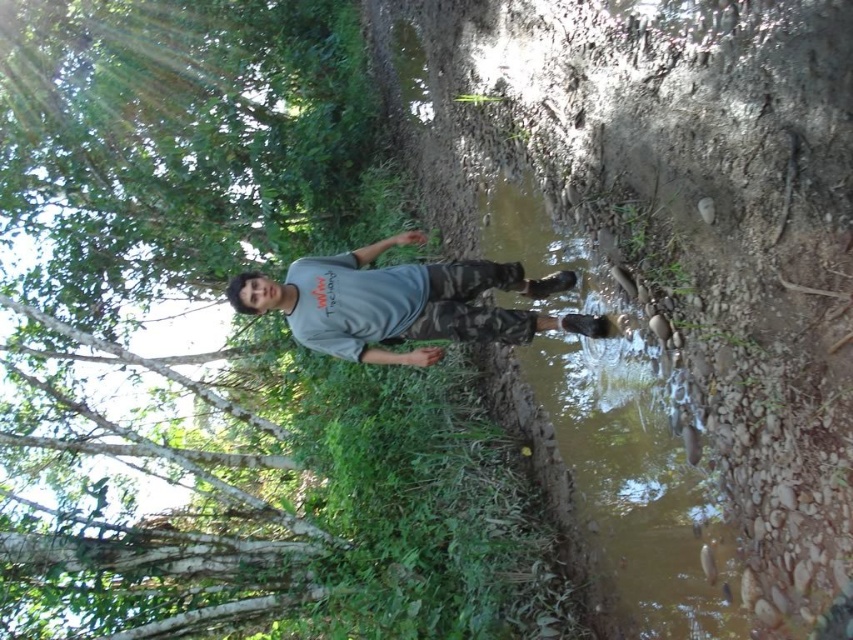
Between point (757, 48) and point (397, 291), which one is positioned behind?

The point (397, 291) is more distant.

Is point (733, 172) positioned in front of point (335, 257)?

Yes, it is.

Locate an element on the screen. brown muddy stream at center is located at coordinates (682, 220).

In the scene shown: Who is higher up, brown muddy stream at center or green leafy tree at upper left?

green leafy tree at upper left

Who is more distant from viewer, (819, 522) or (323, 61)?

Positioned behind is point (323, 61).

Find the location of a particular element. Image resolution: width=853 pixels, height=640 pixels. brown muddy stream at center is located at coordinates (682, 220).

Does green leafy tree at upper left have a lesser height compared to gray matte shirt at center?

Yes.

Who is positioned more to the right, green leafy tree at upper left or gray matte shirt at center?

gray matte shirt at center is more to the right.

Between point (16, 328) and point (257, 310), which one is positioned in front?

Point (257, 310) is in front.

Where is `green leafy tree at upper left`? The height and width of the screenshot is (640, 853). green leafy tree at upper left is located at coordinates (172, 144).